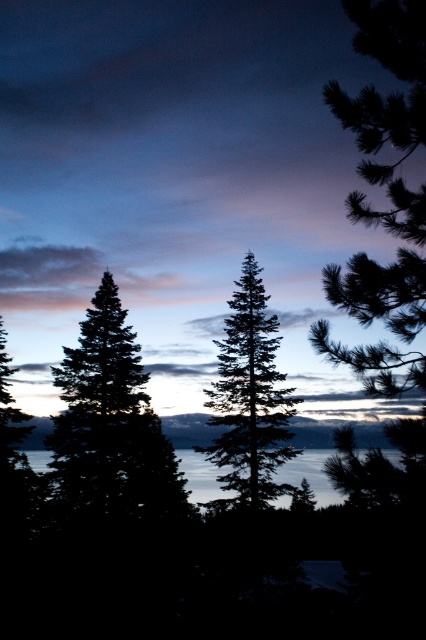
Looking at this image, you are standing in the twilight scene and want to place a small birdhouse exactly at point [175,179]. According to the scene description, where will the birdhouse be positioned relative to the silhouette pine trees at left?

The birdhouse will be placed on the silhouette pine trees at left because the point [175,179] is on the silhouette pine trees at left.

You are standing at the center of the image and want to walk towards the silhouette pine trees at left. In which direction should you move?

You should move to the left since the silhouette pine trees at left are positioned at point (175, 179), which is to the left of the center.

You are an artist planning to paint the scene. You want to ensure the silhouette pine tree at center and the green matte tree at center are proportionally accurate. Which tree should you depict as taller in your painting?

The silhouette pine tree at center should be depicted as taller because it has a greater height compared to the green matte tree at center according to the scene description.